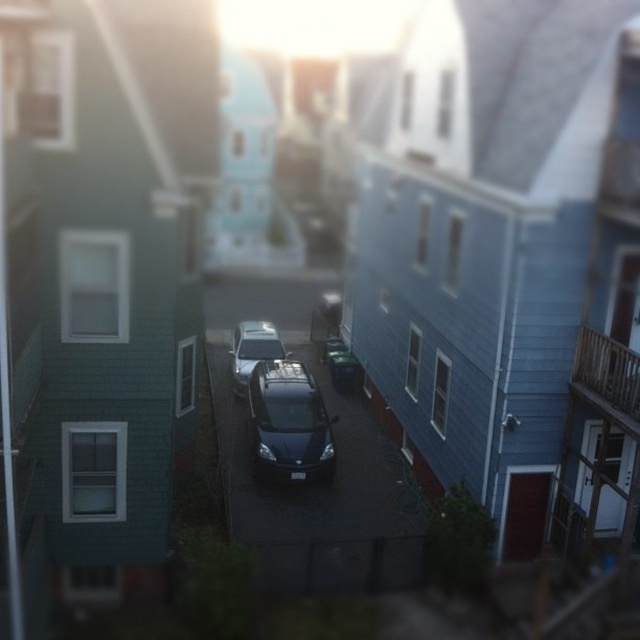
Between matte black car at center and satin silver car at center, which one is positioned higher?

Positioned higher is satin silver car at center.

From the picture: Which is more to the right, matte black car at center or satin silver car at center?

matte black car at center

Image resolution: width=640 pixels, height=640 pixels. What do you see at coordinates (289, 422) in the screenshot?
I see `matte black car at center` at bounding box center [289, 422].

Where is `matte black car at center`? The image size is (640, 640). matte black car at center is located at coordinates (289, 422).